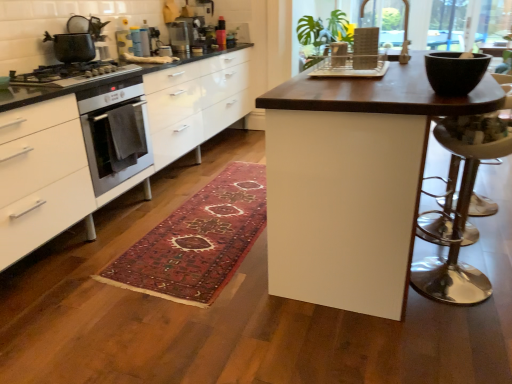
Find the location of a particular element. The height and width of the screenshot is (384, 512). free point above carpeted rug at center (from a real-world perspective) is located at coordinates (218, 213).